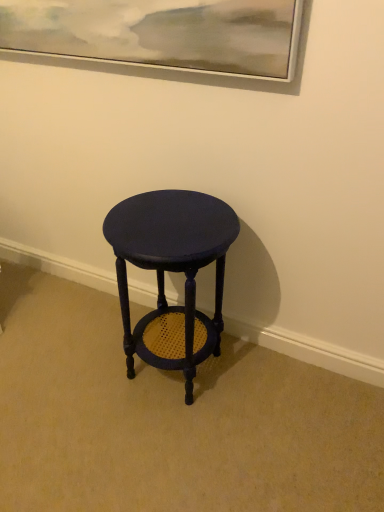
The height and width of the screenshot is (512, 384). I want to click on free point above matte black stool at center (from a real-world perspective), so click(x=167, y=219).